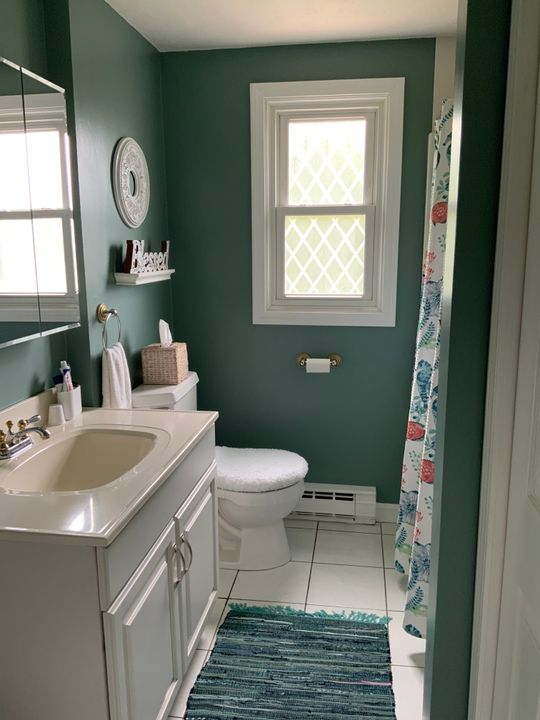
Find the location of a particular element. The width and height of the screenshot is (540, 720). 1 right knob is located at coordinates (32, 418).